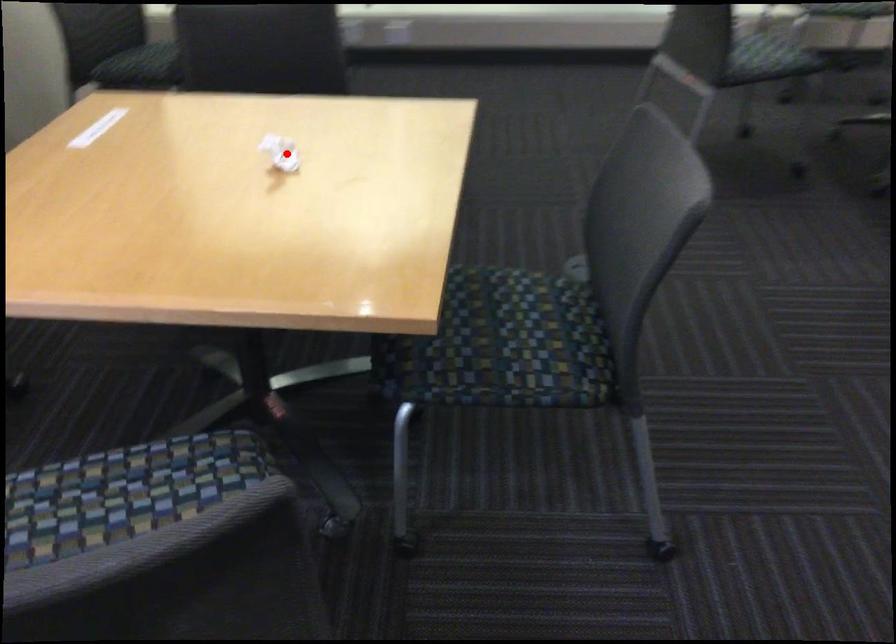
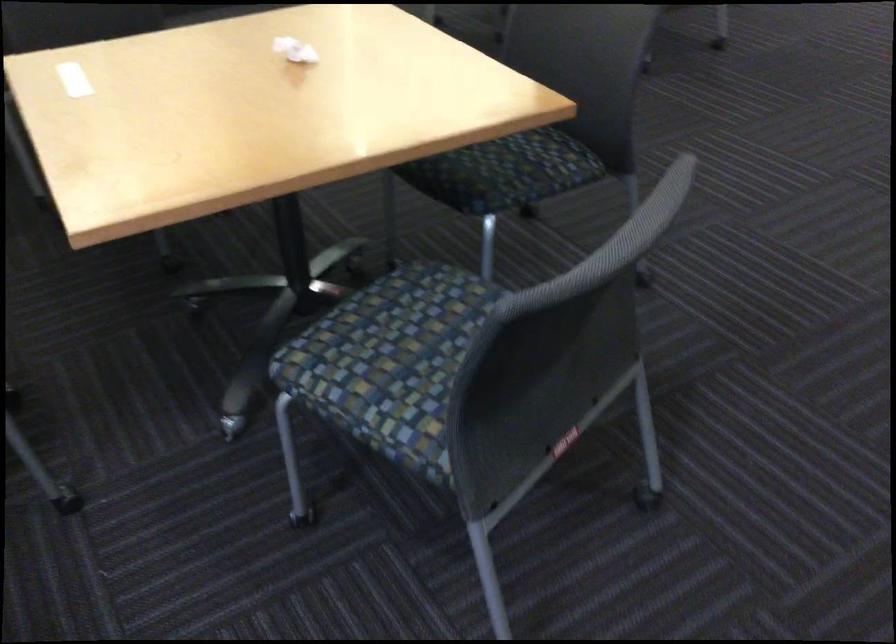
Question: I am providing you with two images of the same scene from different viewpoints. Given a red point in image1, look at the same physical point in image2. Is it:

Choices:
 (A) Closer to the viewpoint
 (B) Farther from the viewpoint

Answer: (B)